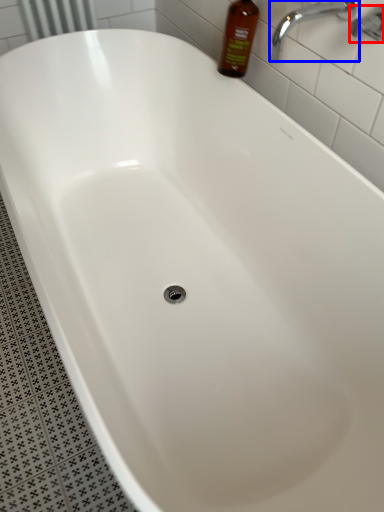
Question: Which point is closer to the camera, plumbing fixture (highlighted by a red box) or tap (highlighted by a blue box)?

Choices:
 (A) plumbing fixture
 (B) tap

Answer: (A)